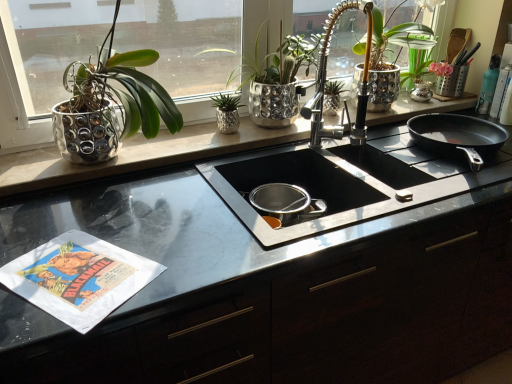
Find the location of a particular element. This screenshot has width=512, height=384. free space in front of green metallic plant at center, which is the 2th houseplant in left-to-right order is located at coordinates (216, 144).